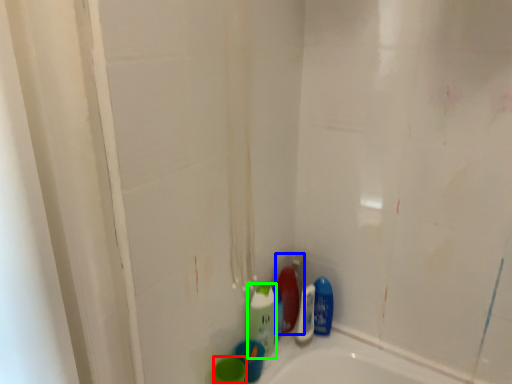
Question: Which is farther away from mouthwash (highlighted by a red box)? cleaning product (highlighted by a blue box) or cleaning product (highlighted by a green box)?

Choices:
 (A) cleaning product
 (B) cleaning product

Answer: (A)